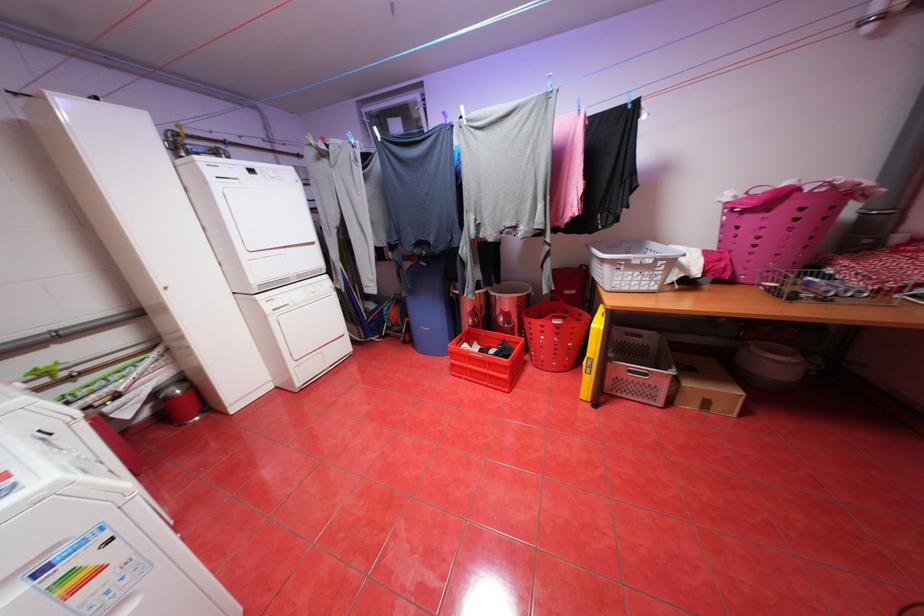
This screenshot has height=616, width=924. Find the location of `red crate handle`. red crate handle is located at coordinates (485, 359).